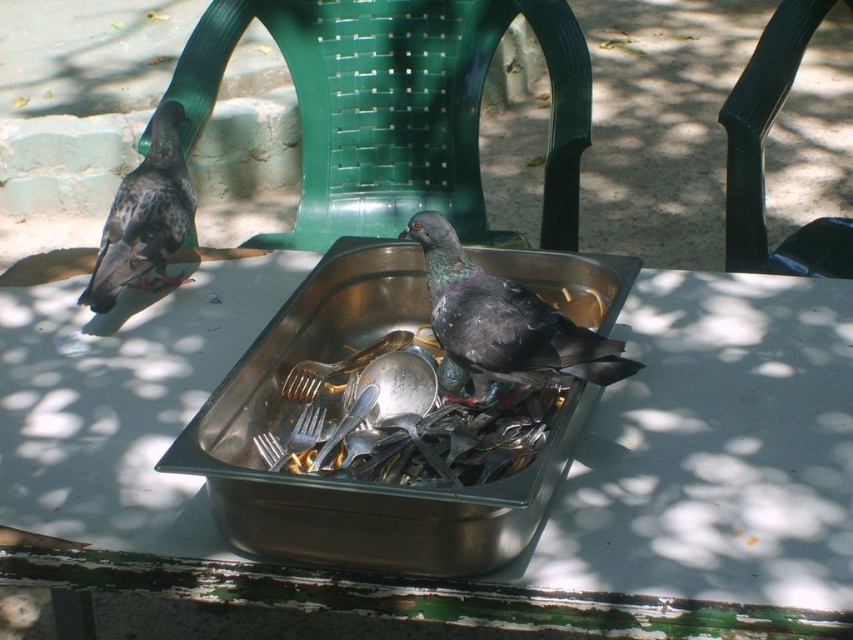
Is green plastic chair at upper center thinner than brushed metal spoon at center?

No, green plastic chair at upper center is not thinner than brushed metal spoon at center.

Is green plastic chair at upper center shorter than brushed metal spoon at center?

No, green plastic chair at upper center is not shorter than brushed metal spoon at center.

Is point (200, 52) behind point (296, 385)?

Yes, point (200, 52) is farther from viewer.

The height and width of the screenshot is (640, 853). I want to click on green plastic chair at upper center, so click(x=397, y=108).

Between stainless steel tray at center and green plastic chair at upper center, which one is positioned lower?

stainless steel tray at center is lower down.

Does point (799, 496) come in front of point (389, 19)?

Yes, point (799, 496) is closer to viewer.

Image resolution: width=853 pixels, height=640 pixels. What are the coordinates of `stainless steel tray at center` in the screenshot? It's located at (553, 496).

How far apart are shiny dark gray bird at center and black plastic chair at upper right?

They are 1.00 meters apart.

Does shiny dark gray bird at center have a larger size compared to black plastic chair at upper right?

No, shiny dark gray bird at center is not bigger than black plastic chair at upper right.

Image resolution: width=853 pixels, height=640 pixels. What do you see at coordinates (503, 323) in the screenshot?
I see `shiny dark gray bird at center` at bounding box center [503, 323].

Identify the location of shiny dark gray bird at center. (503, 323).